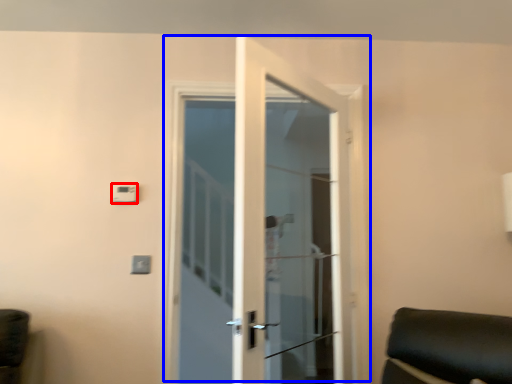
Question: Which object is closer to the camera taking this photo, light switch (highlighted by a red box) or door (highlighted by a blue box)?

Choices:
 (A) light switch
 (B) door

Answer: (B)